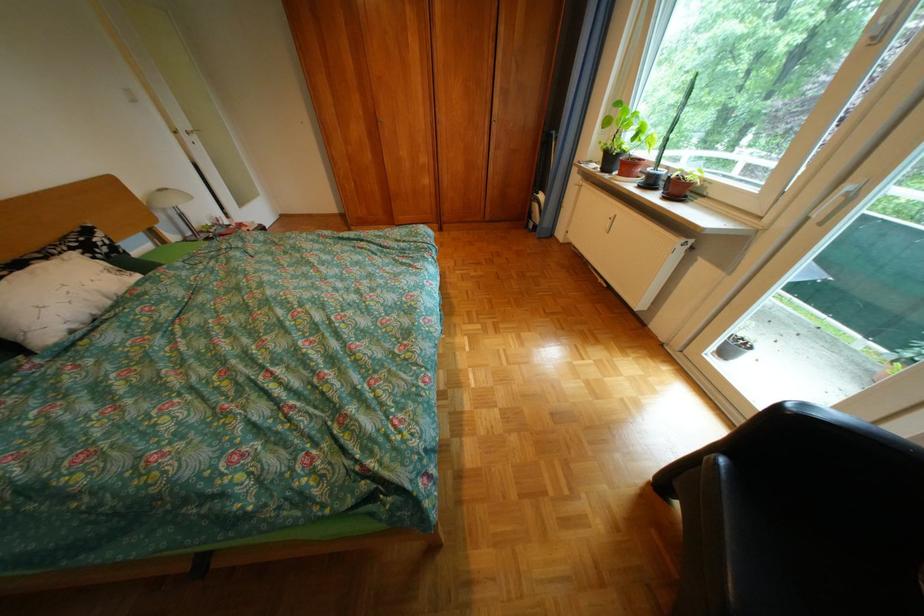
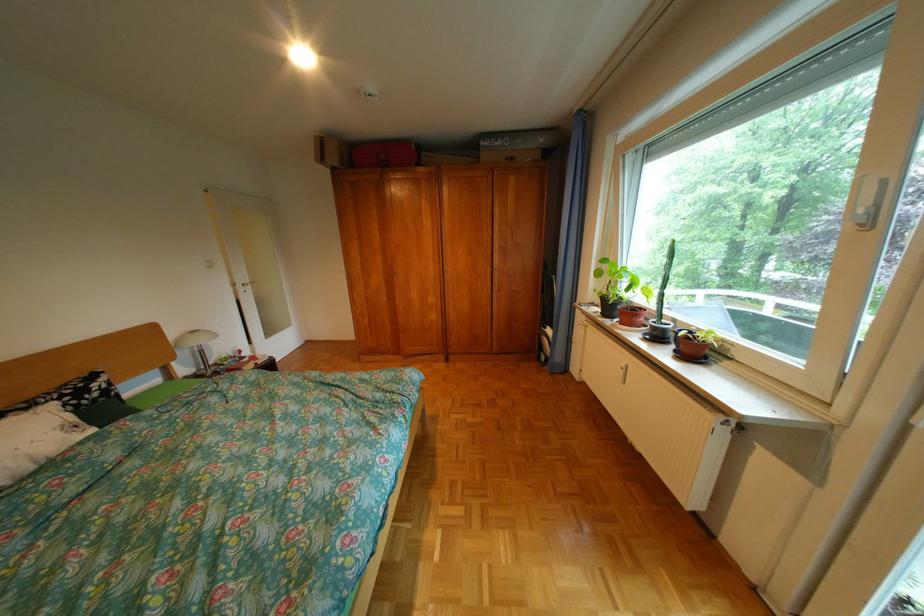
The images are taken continuously from a first-person perspective. In which direction are you moving?

The cameraman moved toward right, forward.